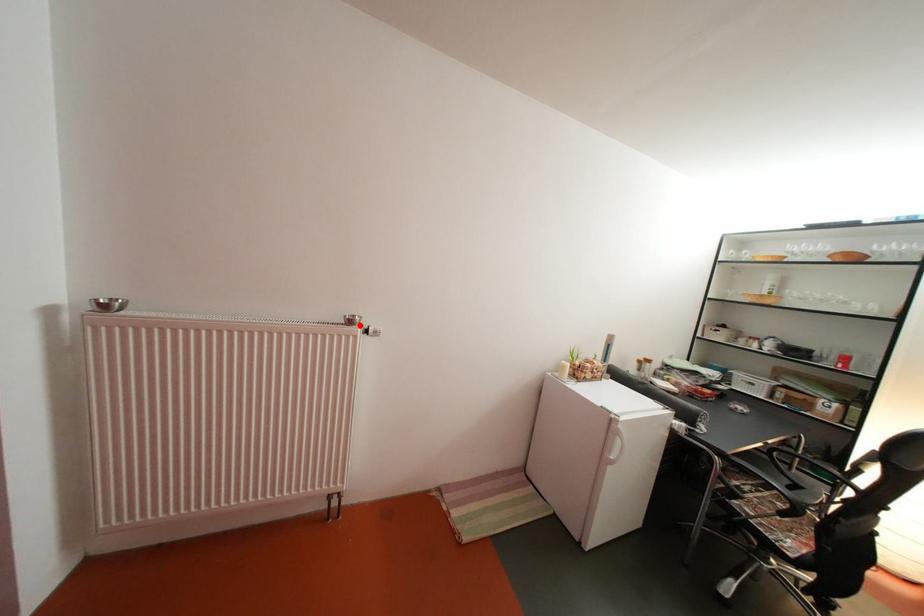
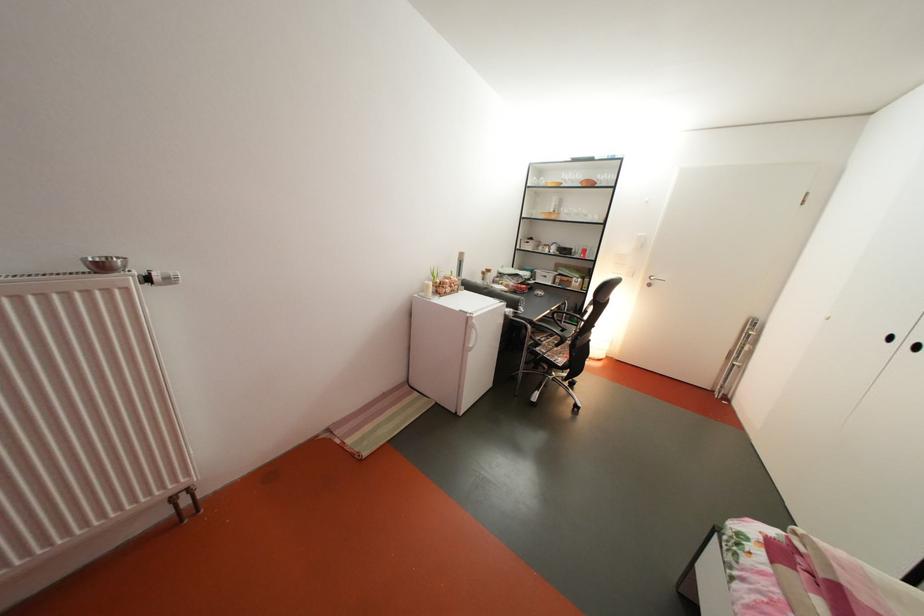
The point at the highlighted location is marked in the first image. Where is the corresponding point in the second image?

(107, 270)